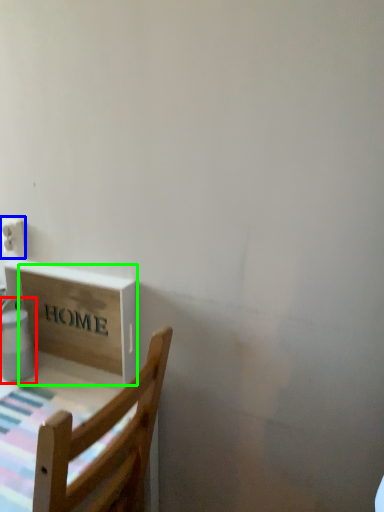
Question: Which object is positioned closest to water heater (highlighted by a red box)? Select from electric outlet (highlighted by a blue box) and cardboard box (highlighted by a green box).

Choices:
 (A) electric outlet
 (B) cardboard box

Answer: (B)